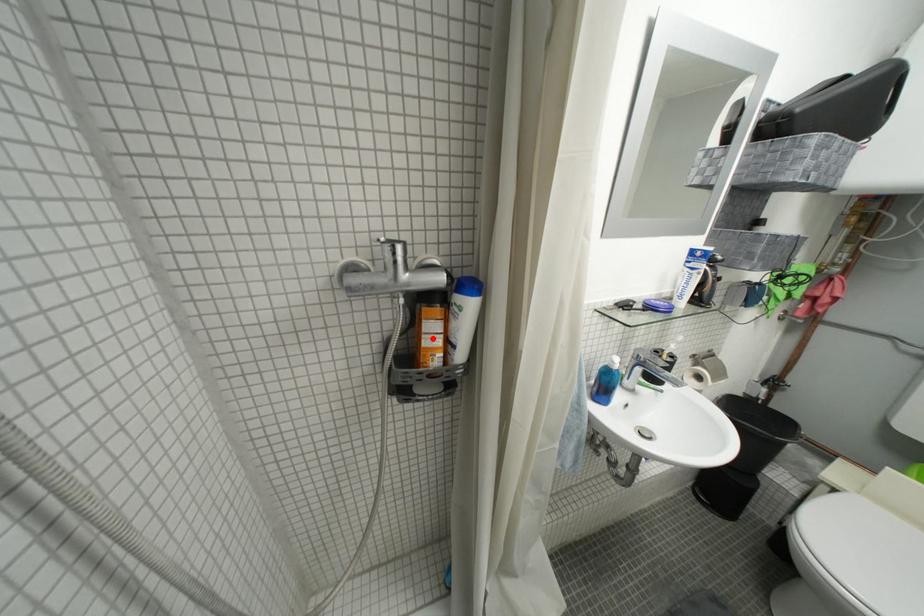
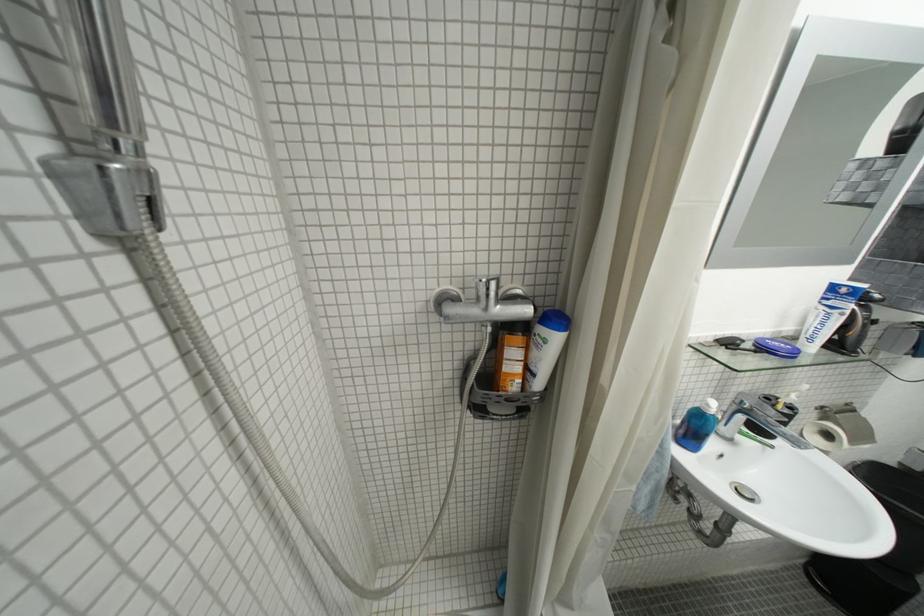
In the second image, find the point that corresponds to the highlighted location in the first image.

(514, 363)